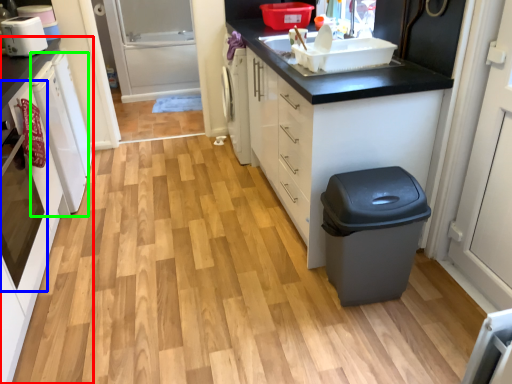
Question: Which object is positioned farthest from cabinetry (highlighted by a red box)? Select from oven (highlighted by a blue box) and dish washer (highlighted by a green box).

Choices:
 (A) oven
 (B) dish washer

Answer: (B)